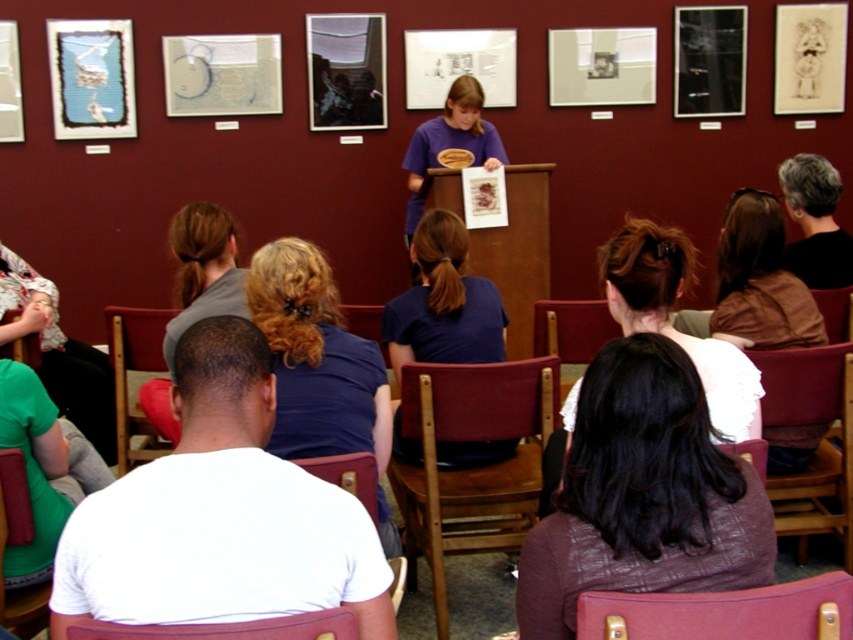
In the scene shown: Is green fabric shirt at lower left wider than maroon leather chair at lower center?

Yes.

Does green fabric shirt at lower left have a greater height compared to maroon leather chair at lower center?

Correct, green fabric shirt at lower left is much taller as maroon leather chair at lower center.

The width and height of the screenshot is (853, 640). I want to click on green fabric shirt at lower left, so click(59, 353).

Which is more to the right, blue fabric hair at center or wooden chair at lower left?

blue fabric hair at center is more to the right.

How much distance is there between blue fabric hair at center and wooden chair at lower left?

blue fabric hair at center and wooden chair at lower left are 37.39 inches apart from each other.

Which is in front, point (281, 284) or point (119, 312)?

Positioned in front is point (281, 284).

At what (x,y) coordinates should I click in order to perform the action: click on blue fabric hair at center. Please return your answer as a coordinate pair (x, y). The height and width of the screenshot is (640, 853). Looking at the image, I should click on (316, 358).

Which of these two, dark blue shirt at center or brown hair at center, stands taller?

With more height is dark blue shirt at center.

Measure the distance from dark blue shirt at center to brown hair at center.

dark blue shirt at center is 24.91 inches from brown hair at center.

Between point (447, 316) and point (167, 232), which one is positioned in front?

Positioned in front is point (447, 316).

In order to click on dark blue shirt at center in this screenshot , I will do `click(444, 301)`.